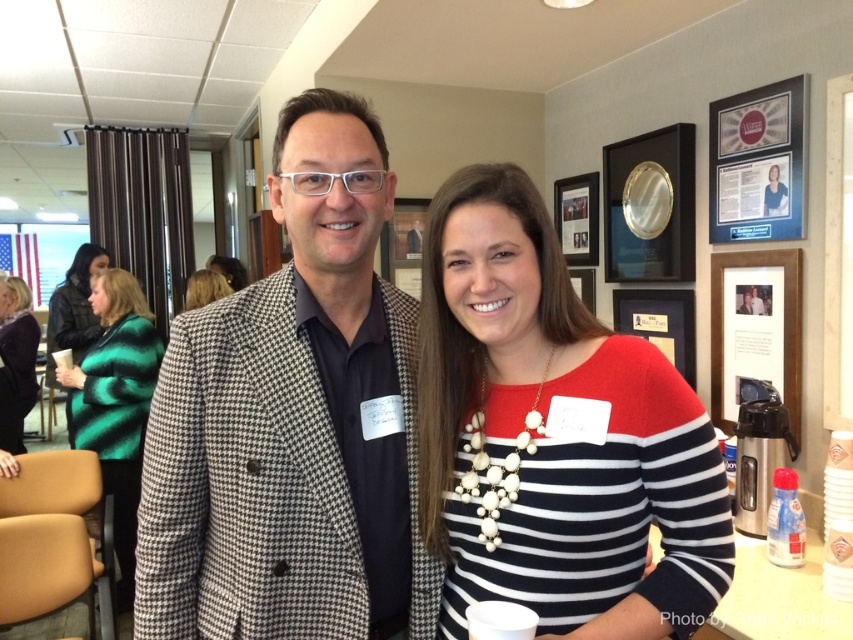
Question: Which point is closer to the camera taking this photo?

Choices:
 (A) (451, 314)
 (B) (67, 326)
 (C) (30, 321)
 (D) (326, 346)

Answer: (A)

Question: Which of the following is the closest to the observer?

Choices:
 (A) pos(140,308)
 (B) pos(10,349)
 (C) pos(86,262)
 (D) pos(187,298)

Answer: (A)

Question: Which is nearer to the green striped sweater at left?

Choices:
 (A) matte black blazer at center
 (B) matte green sweater at left

Answer: (A)

Question: Can you confirm if striped knit sweater at center is positioned below green striped sweater at left?

Choices:
 (A) no
 (B) yes

Answer: (A)

Question: In this image, where is green textured sweater at lower left located relative to matte black blazer at center?

Choices:
 (A) above
 (B) below

Answer: (B)

Question: Does patterned blazer at center appear under matte green sweater at left?

Choices:
 (A) yes
 (B) no

Answer: (A)